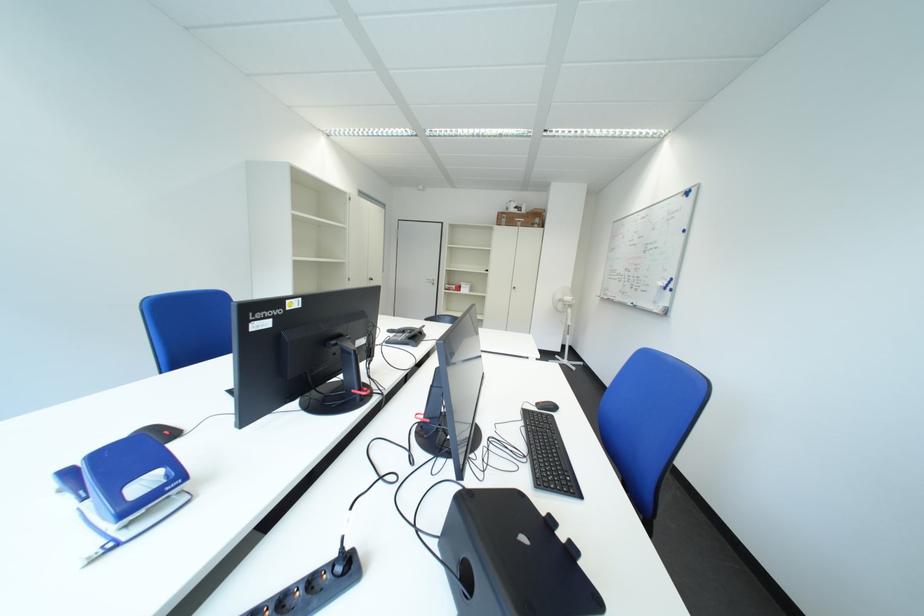
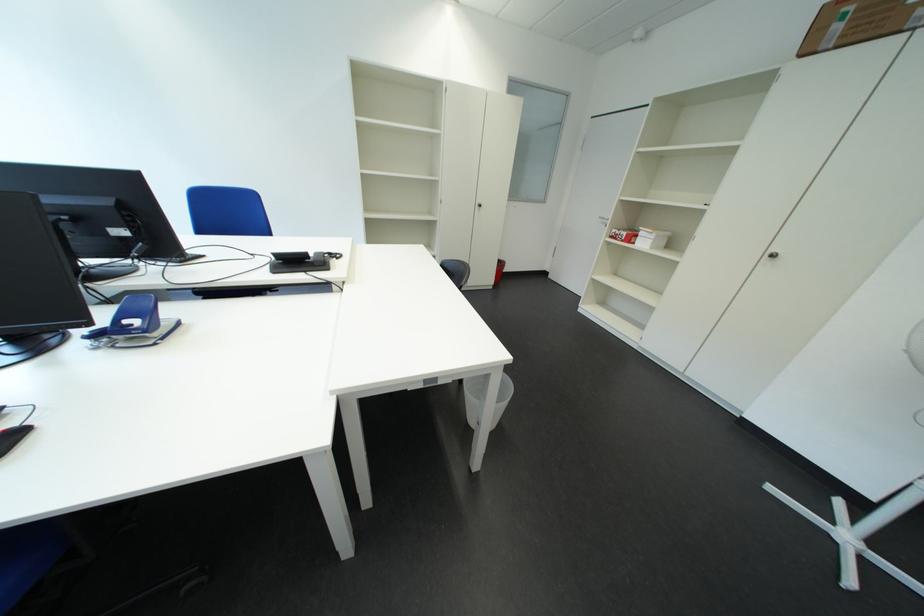
Locate, in the second image, the point that corresponds to the point at 517,223 in the first image.

(849, 30)